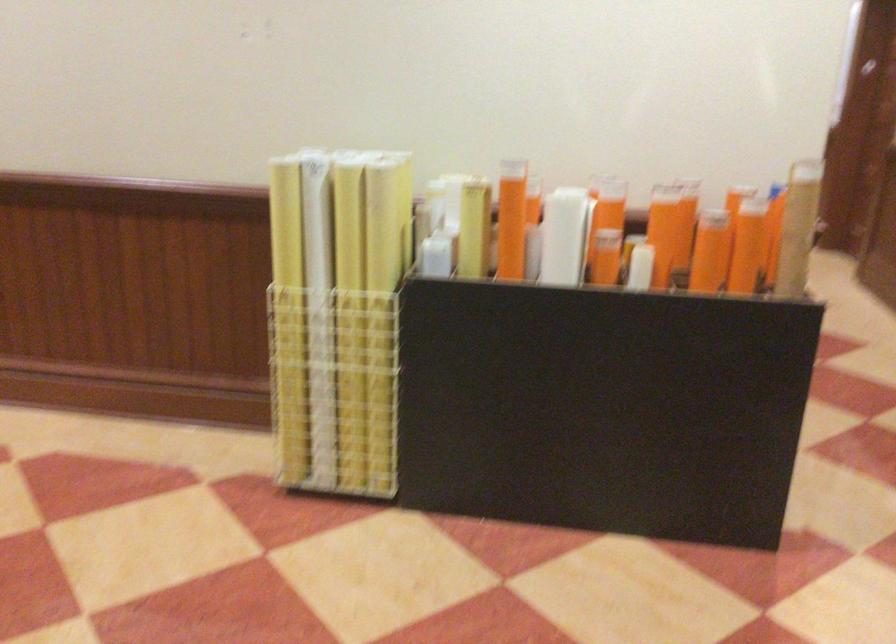
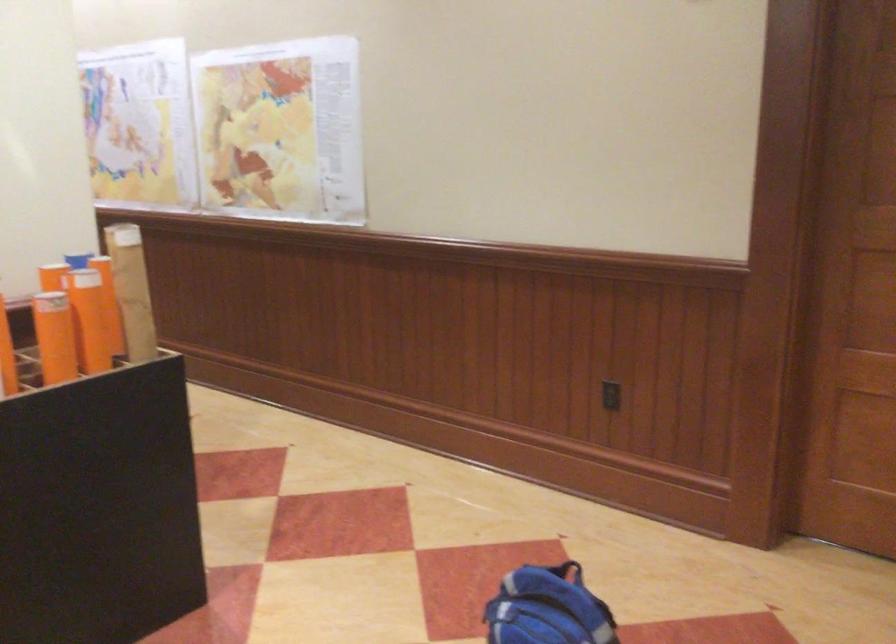
Find the pixel in the second image that matches point 651,258 in the first image.

(6, 355)